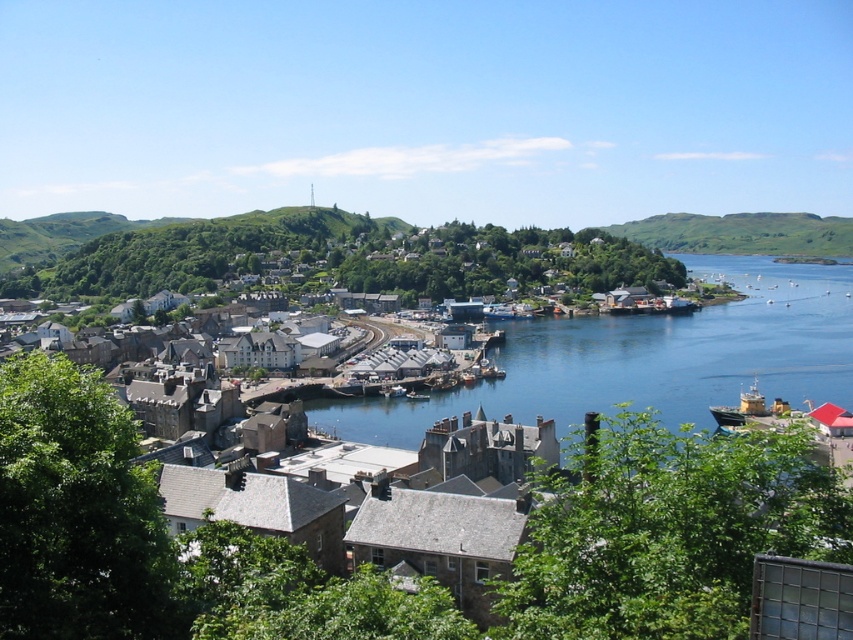
Which is behind, point (759, 292) or point (706, 221)?

The point (706, 221) is more distant.

Identify the location of blue water at center. This screenshot has width=853, height=640. (648, 358).

How much distance is there between blue water at center and green grassy hill at upper left?

252.39 meters

Image resolution: width=853 pixels, height=640 pixels. I want to click on blue water at center, so click(x=648, y=358).

Who is positioned more to the right, green grassy hill at upper left or green grassy hill at right?

A: Positioned to the right is green grassy hill at right.

The image size is (853, 640). I want to click on green grassy hill at upper left, so click(x=160, y=248).

Find the location of a particular element. This screenshot has width=853, height=640. green grassy hill at upper left is located at coordinates (160, 248).